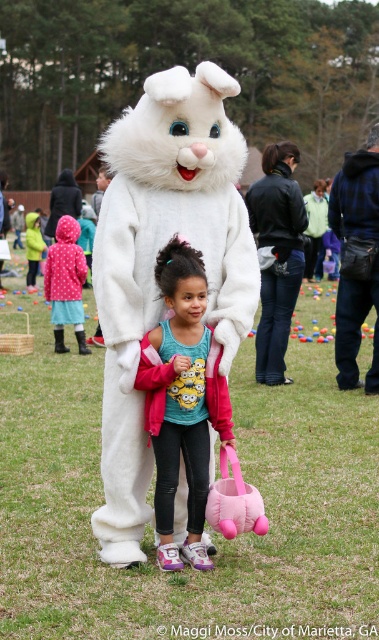
Is white plush bunny at center above pink polka dot coat at left?

No, white plush bunny at center is not above pink polka dot coat at left.

Is white plush bunny at center thinner than pink polka dot coat at left?

Yes.

This screenshot has height=640, width=379. I want to click on white plush bunny at center, so click(x=155, y=260).

Image resolution: width=379 pixels, height=640 pixels. I want to click on white plush bunny at center, so click(155, 260).

The height and width of the screenshot is (640, 379). I want to click on white plush bunny at center, so click(155, 260).

Is point (236, 160) farther from camera compared to point (178, 362)?

That is True.

Image resolution: width=379 pixels, height=640 pixels. I want to click on white plush bunny at center, so click(155, 260).

Who is shorter, matte pink jacket at center or pink polka dot coat at left?

matte pink jacket at center is shorter.

Which is more to the right, matte pink jacket at center or pink polka dot coat at left?

From the viewer's perspective, matte pink jacket at center appears more on the right side.

Does point (166, 529) lie in front of point (56, 252)?

Yes.

The image size is (379, 640). I want to click on matte pink jacket at center, so click(181, 401).